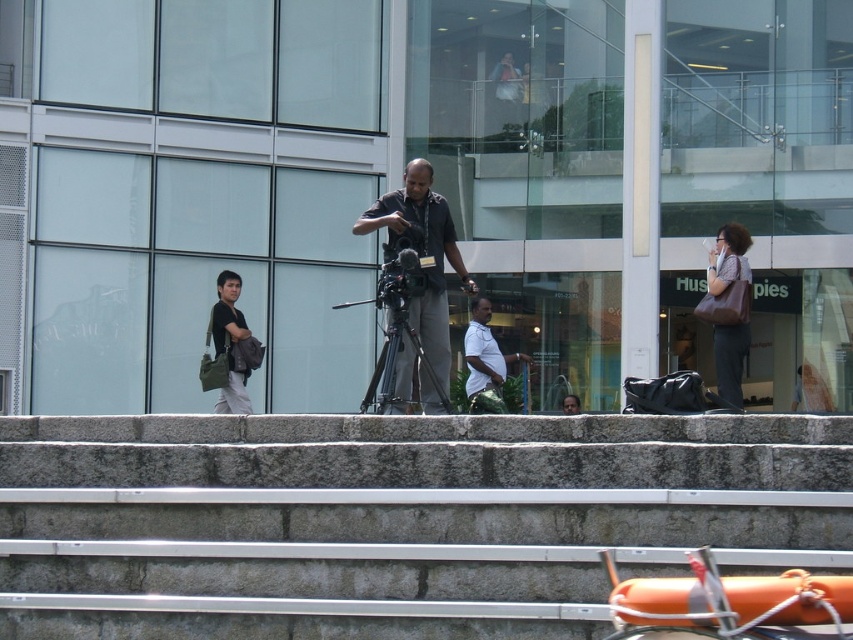
Which is in front, point (247, 531) or point (438, 364)?

Positioned in front is point (247, 531).

Does gray stone steps at center have a smaller size compared to matte black camera at center?

No.

Who is more forward, (560, 618) or (425, 381)?

Point (560, 618) is in front.

Identify the location of gray stone steps at center. (393, 518).

Does light blue shirt at center have a greater height compared to dark gray shirt at center?

Indeed, light blue shirt at center has a greater height compared to dark gray shirt at center.

Who is more forward, (492, 358) or (572, 408)?

Point (492, 358)

You are a GUI agent. You are given a task and a screenshot of the screen. Output one action in this format:
    pyautogui.click(x=<x>, y=<y>)
    Task: Click on the light blue shirt at center
    
    Given the screenshot: What is the action you would take?
    tap(485, 353)

Is matte black bag at left shorter than light blue shirt at center?

No.

Does matte black bag at left appear under light blue shirt at center?

No, matte black bag at left is not below light blue shirt at center.

At what (x,y) coordinates should I click in order to perform the action: click on matte black bag at left. Please return your answer as a coordinate pair (x, y). The height and width of the screenshot is (640, 853). Looking at the image, I should click on (229, 349).